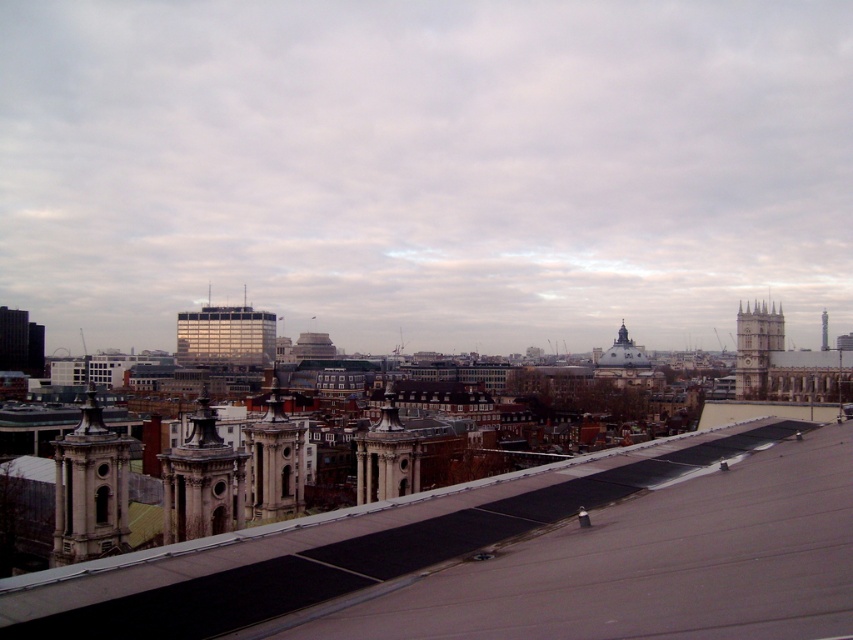
Consider the image. Can you confirm if stone tower at center is positioned to the left of smooth stone tower at center?

Yes, stone tower at center is to the left of smooth stone tower at center.

Does stone tower at center appear on the right side of smooth stone tower at center?

Incorrect, stone tower at center is not on the right side of smooth stone tower at center.

The height and width of the screenshot is (640, 853). I want to click on stone tower at center, so click(273, 461).

Does stone tower at left have a lesser width compared to smooth stone tower at center?

No, stone tower at left is not thinner than smooth stone tower at center.

From the picture: Can you confirm if stone tower at left is positioned to the right of smooth stone tower at center?

Incorrect, stone tower at left is not on the right side of smooth stone tower at center.

This screenshot has height=640, width=853. Identify the location of stone tower at left. (90, 490).

Between point (204, 429) and point (744, 388), which one is positioned in front?

Point (204, 429) is in front.

Who is positioned more to the right, stone tower at center-left or stone clock tower at right?

Positioned to the right is stone clock tower at right.

The image size is (853, 640). Find the location of `stone tower at center-left`. stone tower at center-left is located at coordinates (201, 481).